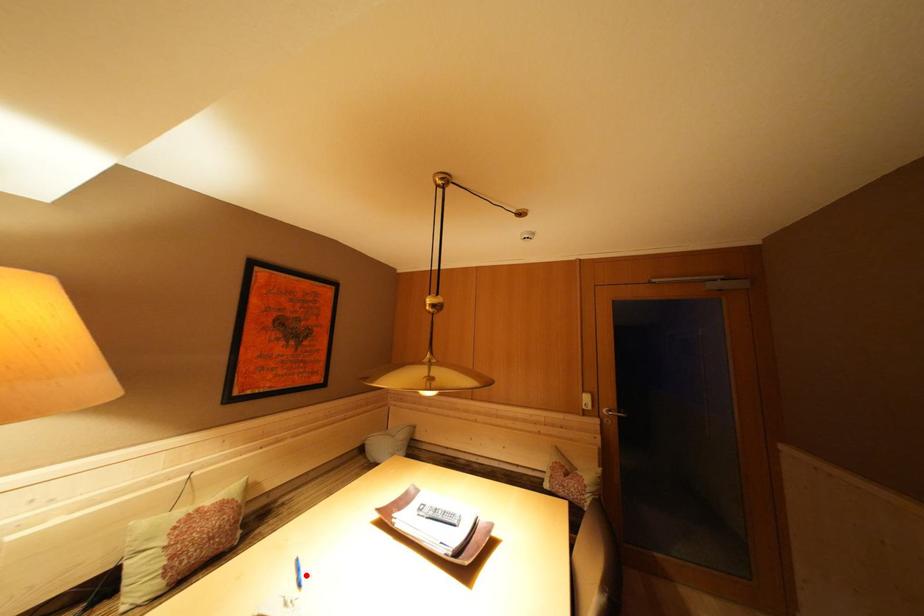
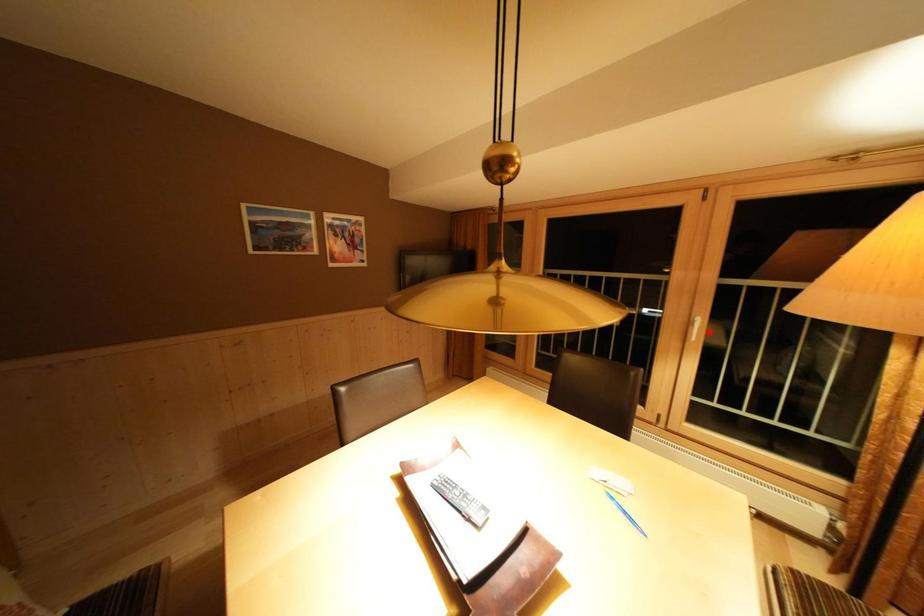
I am providing you with two images of the same scene from different viewpoints. A red point is marked on the first image and another point is marked on the second image. Do the highlighted points in image1 and image2 indicate the same real-world spot?

No